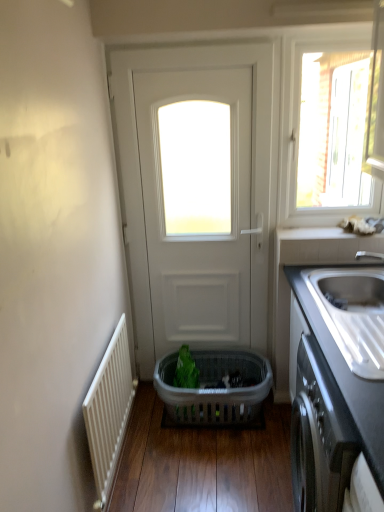
Find the location of a particular element. This screenshot has height=512, width=384. vacant space in front of translucent plastic basket at center is located at coordinates click(209, 468).